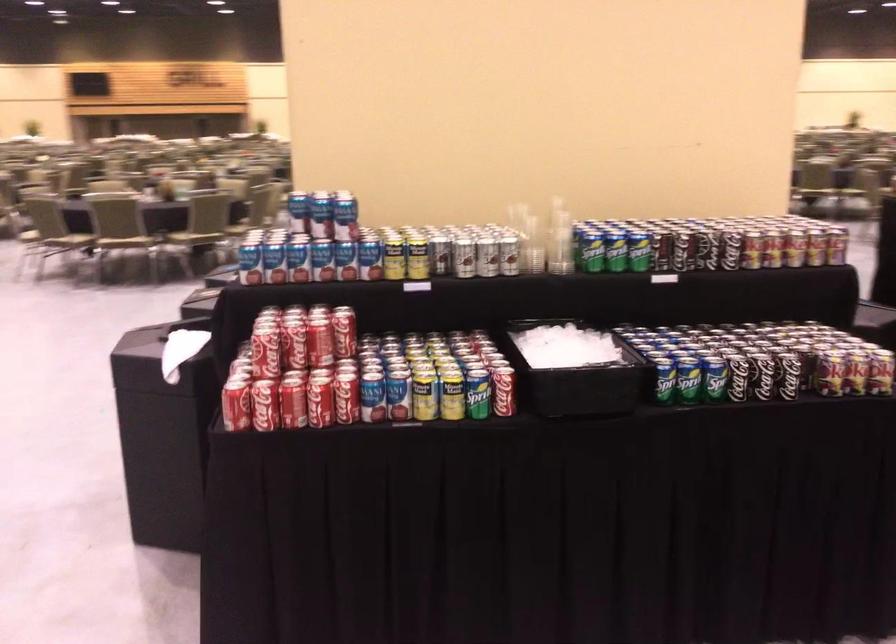
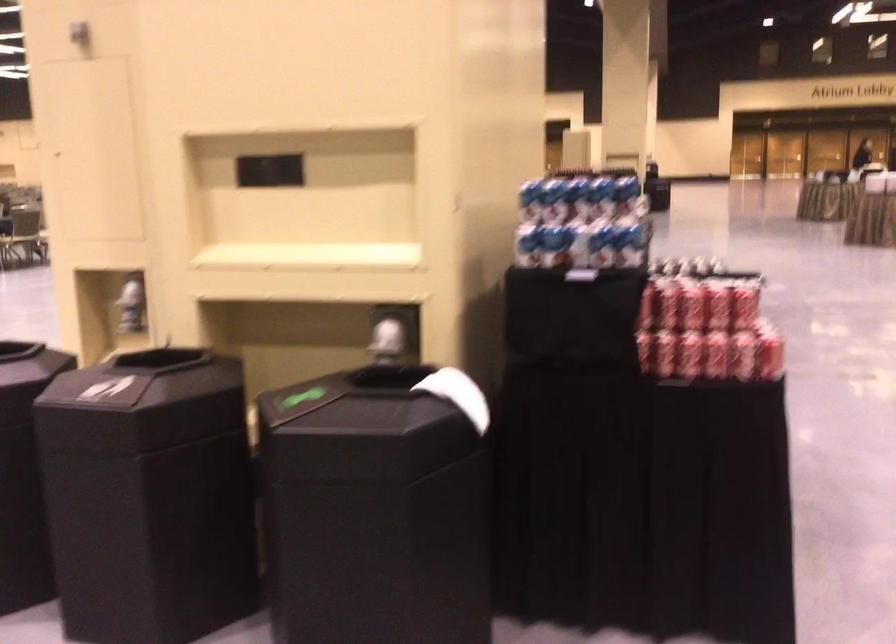
Where in the second image is the point corresponding to (x=247, y=252) from the first image?

(576, 247)